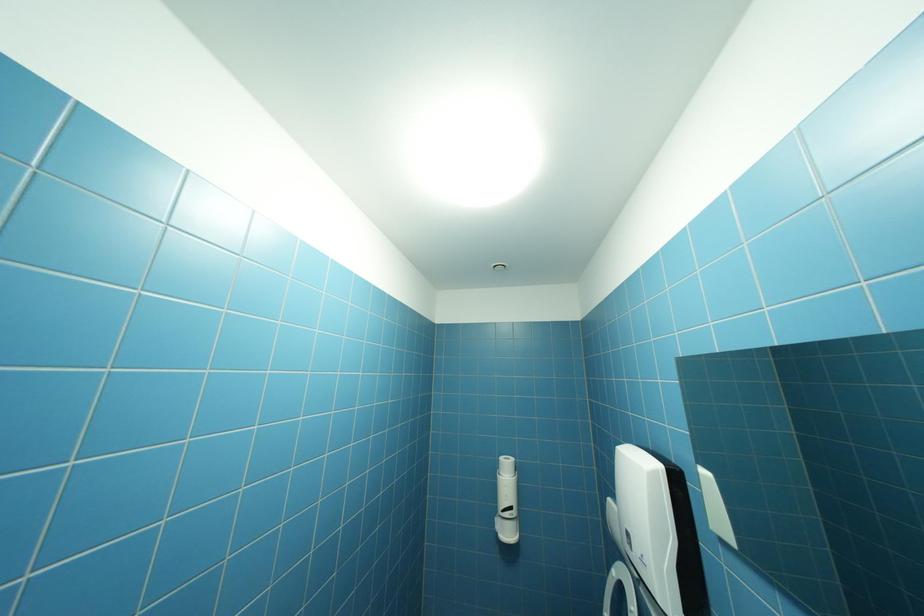
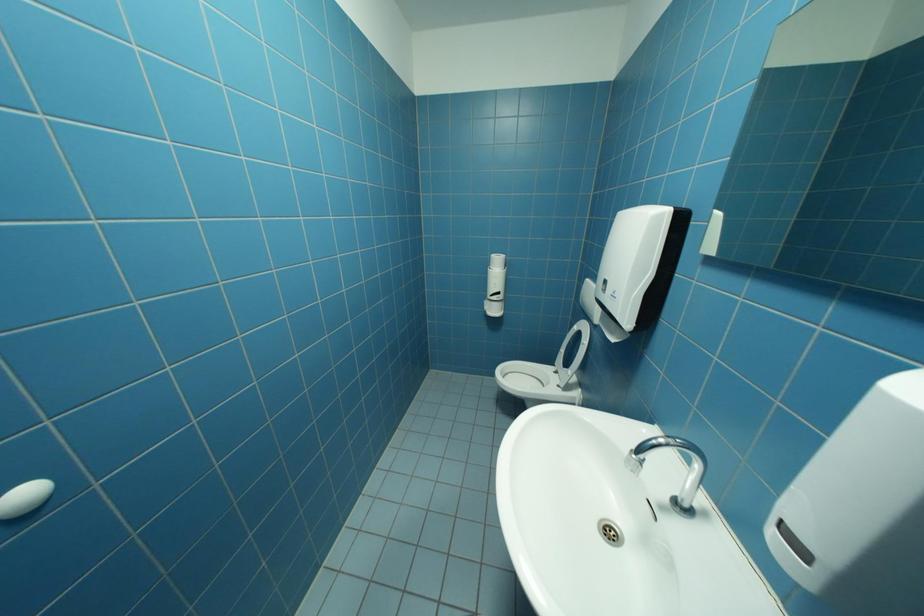
Question: How did the camera likely rotate?

Choices:
 (A) Left
 (B) Right
 (C) Up
 (D) Down

Answer: (D)